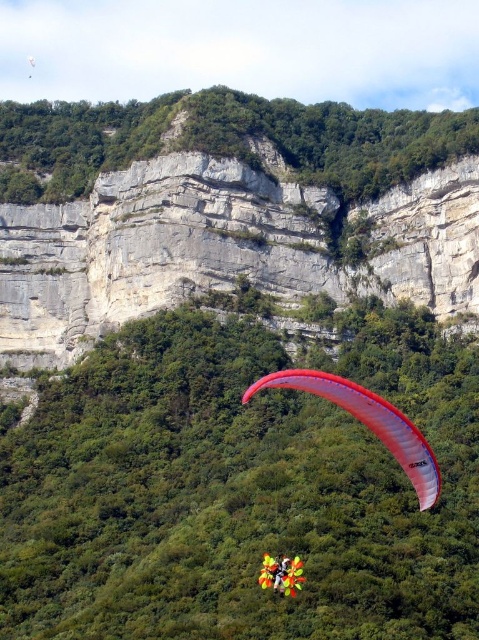
You are a paragliding instructor assessing the safety of the current flight path. The paraglider must maintain a safe distance from the rugged stone cliff at upper center and the yellow fabric parachute at center. Which object requires a larger safety buffer due to its height?

The rugged stone cliff at upper center requires a larger safety buffer because it has a greater height compared to the yellow fabric parachute at center.

You are a paraglider pilot preparing to launch from the cliff edge. You notice two reference points in your field of view. The first is at point (200, 145) and the second at point (395, 451). As you look towards the cliff edge, which point will you encounter first?

You will encounter point (200, 145) first because it is closer to you than point (395, 451), which is further away.